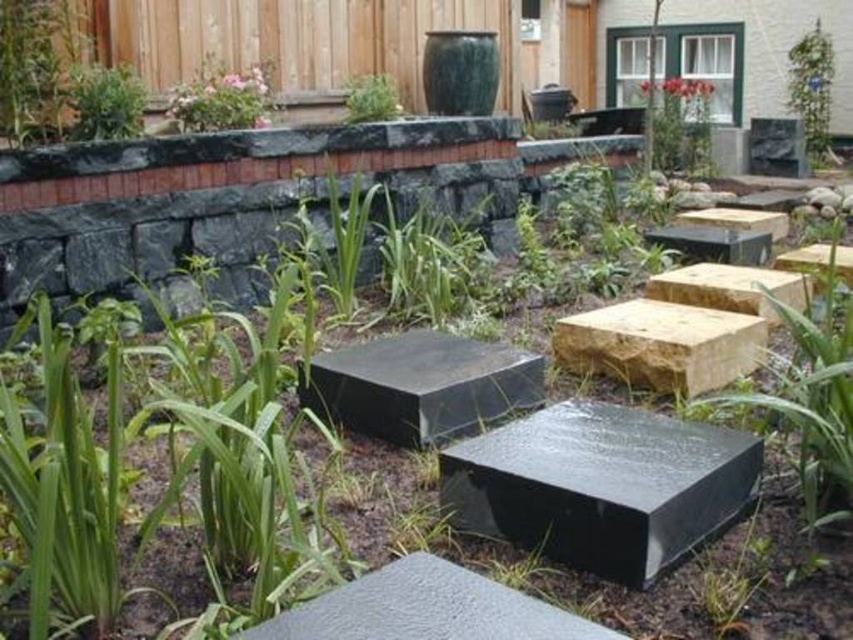
Question: Estimate the real-world distances between objects in this image. Which object is farther from the green glossy trellis at upper right?

Choices:
 (A) green leafy plant at upper left
 (B) yellowish-brown wood at center-right

Answer: (A)

Question: Is matte pink flowers at upper left closer to the viewer compared to green leafy plant at upper center?

Choices:
 (A) no
 (B) yes

Answer: (B)

Question: Observing the image, what is the correct spatial positioning of matte pink flowers at upper left in reference to green leafy plant at upper left?

Choices:
 (A) above
 (B) below

Answer: (A)

Question: Which object is the closest to the black smooth stone at center?

Choices:
 (A) green glossy plant at upper center
 (B) green glossy trellis at upper right
 (C) green leafy plant at upper center

Answer: (C)

Question: Does black smooth stone at center have a lesser width compared to matte pink flowers at upper left?

Choices:
 (A) no
 (B) yes

Answer: (A)

Question: Based on their relative distances, which object is farther from the green leafy plant at upper center?

Choices:
 (A) matte pink flowers at upper left
 (B) green leafy plant at upper left
 (C) yellowish-brown wood at center-right

Answer: (C)